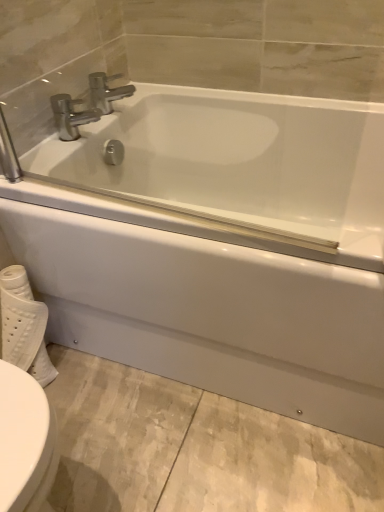
The image size is (384, 512). Identify the location of white textured toilet paper at lower left. [x=24, y=326].

Identify the location of white glossy bathtub at center. The height and width of the screenshot is (512, 384). (219, 247).

Identify the location of polished chrome faucet at upper left, the 1th tap in the bottom-to-top sequence. (70, 116).

Is polished chrome faucet at upper center, placed as the second tap when sorted from bottom to top, not close to white textured toilet paper at lower left?

No, polished chrome faucet at upper center, placed as the second tap when sorted from bottom to top, is not far from white textured toilet paper at lower left.

Between polished chrome faucet at upper center, which ranks as the 1th tap in top-to-bottom order, and white textured toilet paper at lower left, which one has less height?

With less height is polished chrome faucet at upper center, which ranks as the 1th tap in top-to-bottom order.

From the image's perspective, which object appears higher, polished chrome faucet at upper center, which ranks as the 1th tap in top-to-bottom order, or white textured toilet paper at lower left?

polished chrome faucet at upper center, which ranks as the 1th tap in top-to-bottom order, is shown above in the image.

Which object is closer to the camera taking this photo, polished chrome faucet at upper left, arranged as the 2th tap when viewed from the top, or white glossy bathtub at center?

white glossy bathtub at center is more forward.

From the picture: Considering the sizes of objects polished chrome faucet at upper left, the 1th tap in the bottom-to-top sequence, and white glossy bathtub at center in the image provided, who is taller, polished chrome faucet at upper left, the 1th tap in the bottom-to-top sequence, or white glossy bathtub at center?

With more height is white glossy bathtub at center.

Is polished chrome faucet at upper left, arranged as the 2th tap when viewed from the top, thinner than white glossy bathtub at center?

Correct, the width of polished chrome faucet at upper left, arranged as the 2th tap when viewed from the top, is less than that of white glossy bathtub at center.

Considering the sizes of polished chrome faucet at upper left, arranged as the 2th tap when viewed from the top, and white glossy bathtub at center in the image, is polished chrome faucet at upper left, arranged as the 2th tap when viewed from the top, bigger or smaller than white glossy bathtub at center?

Clearly, polished chrome faucet at upper left, arranged as the 2th tap when viewed from the top, is smaller in size than white glossy bathtub at center.

Considering the positions of point (23, 272) and point (96, 95), is point (23, 272) closer or farther from the camera than point (96, 95)?

Point (23, 272).

Which is behind, white textured toilet paper at lower left or polished chrome faucet at upper center, placed as the second tap when sorted from bottom to top?

polished chrome faucet at upper center, placed as the second tap when sorted from bottom to top.

How many degrees apart are the facing directions of white textured toilet paper at lower left and polished chrome faucet at upper center, which ranks as the 1th tap in top-to-bottom order?

The facing directions of white textured toilet paper at lower left and polished chrome faucet at upper center, which ranks as the 1th tap in top-to-bottom order, are 0.936 degrees apart.

Image resolution: width=384 pixels, height=512 pixels. What are the coordinates of `the 1st tap located above the white textured toilet paper at lower left (from a real-world perspective)` in the screenshot? It's located at (70, 116).

From the picture: Is white textured toilet paper at lower left looking in the opposite direction of polished chrome faucet at upper left, the 1th tap in the bottom-to-top sequence?

white textured toilet paper at lower left is not turned away from polished chrome faucet at upper left, the 1th tap in the bottom-to-top sequence.

Is white textured toilet paper at lower left smaller than polished chrome faucet at upper left, the 1th tap in the bottom-to-top sequence?

Incorrect, white textured toilet paper at lower left is not smaller in size than polished chrome faucet at upper left, the 1th tap in the bottom-to-top sequence.

Would you say white textured toilet paper at lower left is inside or outside polished chrome faucet at upper left, the 1th tap in the bottom-to-top sequence?

white textured toilet paper at lower left is not enclosed by polished chrome faucet at upper left, the 1th tap in the bottom-to-top sequence.

From the image's perspective, which is above, polished chrome faucet at upper left, the 1th tap in the bottom-to-top sequence, or polished chrome faucet at upper center, which ranks as the 1th tap in top-to-bottom order?

From the image's view, polished chrome faucet at upper center, which ranks as the 1th tap in top-to-bottom order, is above.

Is point (61, 139) positioned in front of point (118, 89)?

Yes, point (61, 139) is closer to viewer.

Consider the image. From their relative heights in the image, would you say polished chrome faucet at upper left, the 1th tap in the bottom-to-top sequence, is taller or shorter than polished chrome faucet at upper center, which ranks as the 1th tap in top-to-bottom order?

Clearly, polished chrome faucet at upper left, the 1th tap in the bottom-to-top sequence, is taller compared to polished chrome faucet at upper center, which ranks as the 1th tap in top-to-bottom order.

Find the location of a particular element. bathtub above the white textured toilet paper at lower left (from the image's perspective) is located at coordinates (219, 247).

From their relative heights in the image, would you say white textured toilet paper at lower left is taller or shorter than white glossy bathtub at center?

white textured toilet paper at lower left is shorter than white glossy bathtub at center.

From the image's perspective, would you say white textured toilet paper at lower left is positioned over white glossy bathtub at center?

No.

Which object is thinner, white textured toilet paper at lower left or white glossy bathtub at center?

Thinner between the two is white textured toilet paper at lower left.

From the image's perspective, is polished chrome faucet at upper center, placed as the second tap when sorted from bottom to top, below white glossy bathtub at center?

Actually, polished chrome faucet at upper center, placed as the second tap when sorted from bottom to top, appears above white glossy bathtub at center in the image.

Would you say polished chrome faucet at upper center, which ranks as the 1th tap in top-to-bottom order, is inside or outside white glossy bathtub at center?

polished chrome faucet at upper center, which ranks as the 1th tap in top-to-bottom order, is not inside white glossy bathtub at center, it's outside.

From a real-world perspective, which object stands above the other?

From a 3D spatial view, polished chrome faucet at upper center, placed as the second tap when sorted from bottom to top, is above.

Which is behind, point (109, 101) or point (91, 125)?

The point (109, 101) is farther.

Locate an element on the screen. Image resolution: width=384 pixels, height=512 pixels. toilet paper in front of the polished chrome faucet at upper center, placed as the second tap when sorted from bottom to top is located at coordinates (24, 326).

From the image's perspective, starting from the white glossy bathtub at center, which tap is the 1st one above? Please provide its 2D coordinates.

[(70, 116)]

Considering their positions, is white textured toilet paper at lower left positioned further to polished chrome faucet at upper left, arranged as the 2th tap when viewed from the top, than polished chrome faucet at upper center, placed as the second tap when sorted from bottom to top?

Among the two, white textured toilet paper at lower left is located further to polished chrome faucet at upper left, arranged as the 2th tap when viewed from the top.

Considering their positions, is polished chrome faucet at upper left, arranged as the 2th tap when viewed from the top, positioned closer to white glossy bathtub at center than polished chrome faucet at upper center, placed as the second tap when sorted from bottom to top?

polished chrome faucet at upper left, arranged as the 2th tap when viewed from the top.

Considering their positions, is polished chrome faucet at upper center, placed as the second tap when sorted from bottom to top, positioned further to polished chrome faucet at upper left, the 1th tap in the bottom-to-top sequence, than white glossy bathtub at center?

Based on the image, white glossy bathtub at center appears to be further to polished chrome faucet at upper left, the 1th tap in the bottom-to-top sequence.

Which object lies further to the anchor point polished chrome faucet at upper center, which ranks as the 1th tap in top-to-bottom order, polished chrome faucet at upper left, arranged as the 2th tap when viewed from the top, or white textured toilet paper at lower left?

white textured toilet paper at lower left.

Based on their spatial positions, is polished chrome faucet at upper left, arranged as the 2th tap when viewed from the top, or white textured toilet paper at lower left closer to white glossy bathtub at center?

white textured toilet paper at lower left lies closer to white glossy bathtub at center than the other object.

When comparing their distances from polished chrome faucet at upper left, the 1th tap in the bottom-to-top sequence, does white glossy bathtub at center or white textured toilet paper at lower left seem closer?

white glossy bathtub at center.

From the image, which object appears to be farther from white textured toilet paper at lower left, white glossy bathtub at center or polished chrome faucet at upper center, which ranks as the 1th tap in top-to-bottom order?

Among the two, polished chrome faucet at upper center, which ranks as the 1th tap in top-to-bottom order, is located further to white textured toilet paper at lower left.

Which object lies further to the anchor point white glossy bathtub at center, white textured toilet paper at lower left or polished chrome faucet at upper center, placed as the second tap when sorted from bottom to top?

polished chrome faucet at upper center, placed as the second tap when sorted from bottom to top, lies further to white glossy bathtub at center than the other object.

This screenshot has height=512, width=384. What are the coordinates of `tap located between white glossy bathtub at center and polished chrome faucet at upper center, which ranks as the 1th tap in top-to-bottom order, in the depth direction` in the screenshot? It's located at (70, 116).

You are a GUI agent. You are given a task and a screenshot of the screen. Output one action in this format:
    pyautogui.click(x=<x>, y=<y>)
    Task: Click on the bathtub between polished chrome faucet at upper center, placed as the second tap when sorted from bottom to top, and white textured toilet paper at lower left, in the vertical direction
    This screenshot has height=512, width=384.
    Given the screenshot: What is the action you would take?
    pyautogui.click(x=219, y=247)

The height and width of the screenshot is (512, 384). Identify the location of bathtub between polished chrome faucet at upper left, arranged as the 2th tap when viewed from the top, and white textured toilet paper at lower left, in the vertical direction. (219, 247).

The image size is (384, 512). Identify the location of tap between polished chrome faucet at upper center, placed as the second tap when sorted from bottom to top, and white textured toilet paper at lower left in the up-down direction. (70, 116).